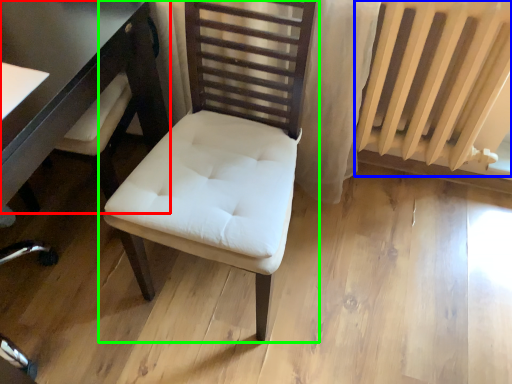
Question: Which is nearer to the table (highlighted by a red box)? radiator (highlighted by a blue box) or chair (highlighted by a green box).

Choices:
 (A) radiator
 (B) chair

Answer: (B)